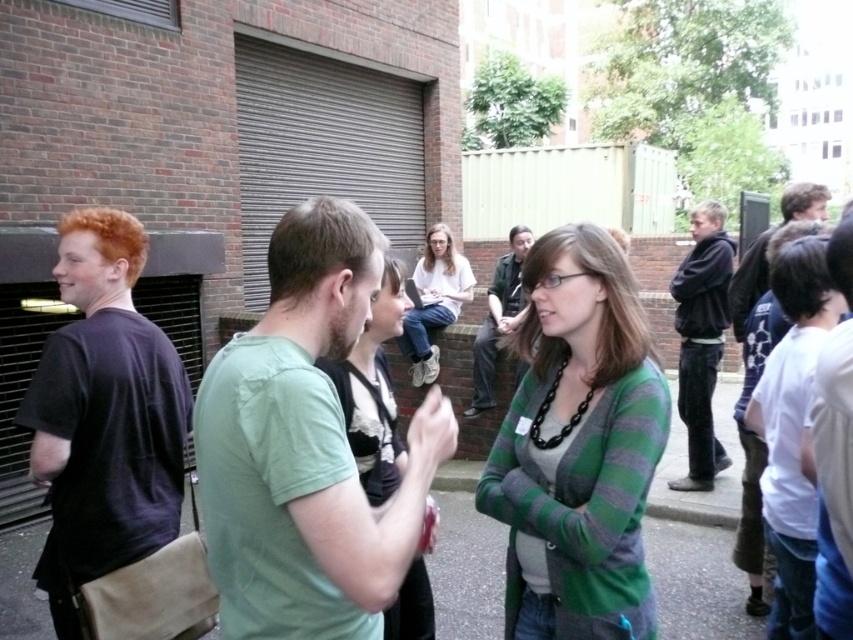
How much distance is there between dark brown t-shirt at left and white shirt at center?

1.91 meters

Which is behind, point (115, 342) or point (842, 371)?

The point (115, 342) is behind.

Find the location of `dark brown t-shirt at left`. dark brown t-shirt at left is located at coordinates (103, 416).

What do you see at coordinates (373, 392) in the screenshot? I see `matte green cardigan at center` at bounding box center [373, 392].

I want to click on matte green cardigan at center, so click(373, 392).

Which is behind, point (341, 384) or point (735, 272)?

Positioned behind is point (735, 272).

I want to click on matte green cardigan at center, so click(x=373, y=392).

In the scene shown: Between dark gray hoodie at right and white matte shirt at center, which one is positioned higher?

white matte shirt at center is above.

Does dark gray hoodie at right come behind white matte shirt at center?

Yes, it is behind white matte shirt at center.

What do you see at coordinates (701, 339) in the screenshot?
I see `dark gray hoodie at right` at bounding box center [701, 339].

At what (x,y) coordinates should I click in order to perform the action: click on dark gray hoodie at right. Please return your answer as a coordinate pair (x, y). Looking at the image, I should click on (701, 339).